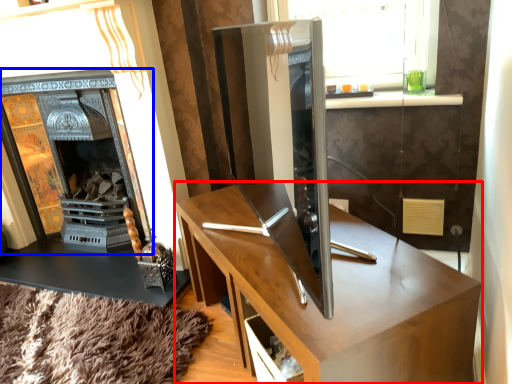
Question: Which object is closer to the camera taking this photo, desk (highlighted by a red box) or fireplace (highlighted by a blue box)?

Choices:
 (A) desk
 (B) fireplace

Answer: (A)